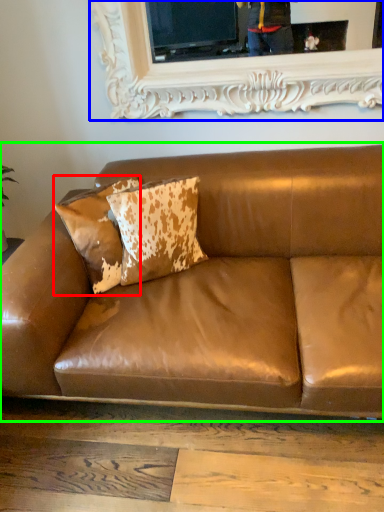
Question: Which object is positioned farthest from pillow (highlighted by a red box)? Select from picture frame (highlighted by a blue box) and studio couch (highlighted by a green box).

Choices:
 (A) picture frame
 (B) studio couch

Answer: (A)